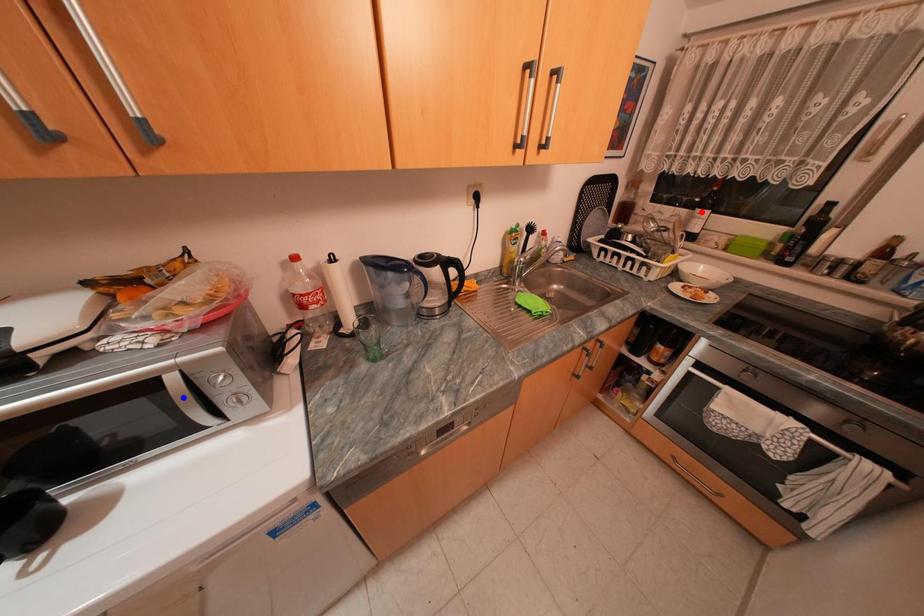
Question: In the image, two points are highlighted. Which point is nearer to the camera? Reply with the corresponding letter.

Choices:
 (A) blue point
 (B) red point

Answer: (A)